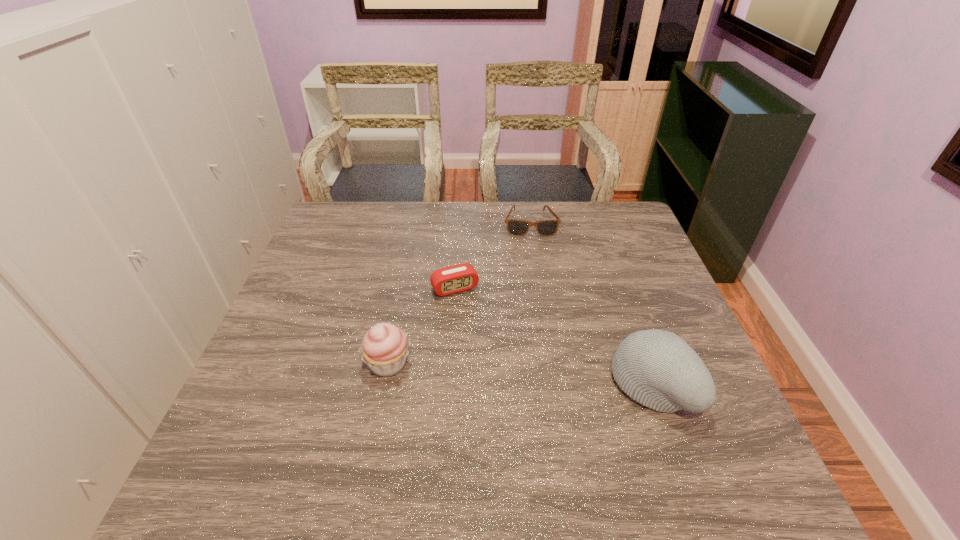
Identify the location of free space that satisfies the following two spatial constraints: 1. on the back side of the alarm clock; 2. on the right side of the cupcake. (403, 288).

This screenshot has width=960, height=540. I want to click on vacant area that satisfies the following two spatial constraints: 1. on the back side of the farthest object; 2. on the left side of the second object from left to right, so click(459, 224).